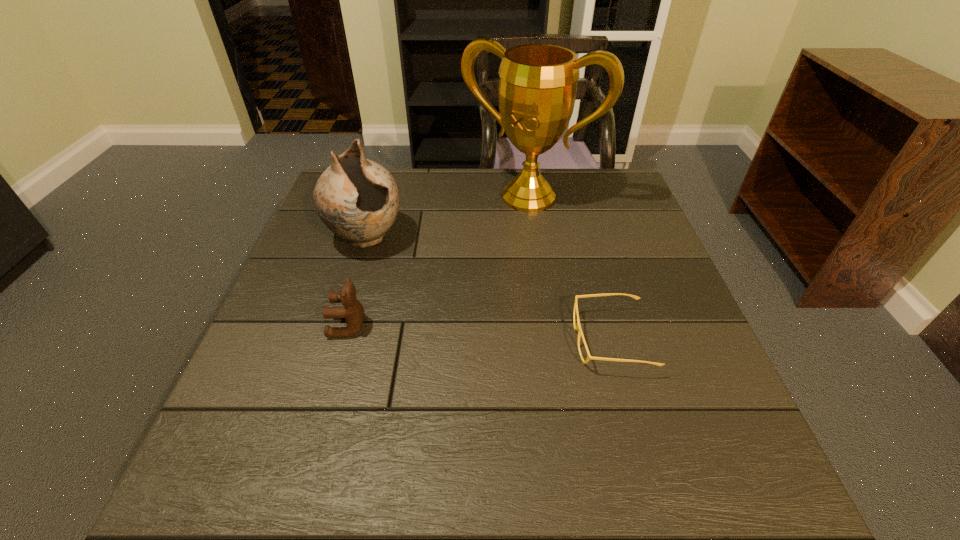
Where is `object that is at the far right corner`? The height and width of the screenshot is (540, 960). object that is at the far right corner is located at coordinates (537, 89).

In the image, there is a desktop. Identify the location of free space at the far edge. The width and height of the screenshot is (960, 540). (465, 188).

Find the location of a particular element. Image resolution: width=960 pixels, height=540 pixels. blank space at the near edge is located at coordinates (395, 427).

Locate an element on the screen. This screenshot has width=960, height=540. free space at the left edge of the desktop is located at coordinates (272, 309).

Where is `free space at the right edge of the desktop`? Image resolution: width=960 pixels, height=540 pixels. free space at the right edge of the desktop is located at coordinates (668, 277).

In order to click on vacant region at the far right corner of the desktop in this screenshot , I will do `click(592, 185)`.

Find the location of a particular element. The height and width of the screenshot is (540, 960). unoccupied position between the award and the teddy bear is located at coordinates (439, 261).

At what (x,y) coordinates should I click in order to perform the action: click on free space between the third tallest object and the shortest object. Please return your answer as a coordinate pair (x, y). Looking at the image, I should click on (480, 333).

The image size is (960, 540). I want to click on vacant area between the third tallest object and the third shortest object, so click(x=357, y=282).

The height and width of the screenshot is (540, 960). In order to click on free space between the pottery and the spectacles in this screenshot , I will do pyautogui.click(x=489, y=289).